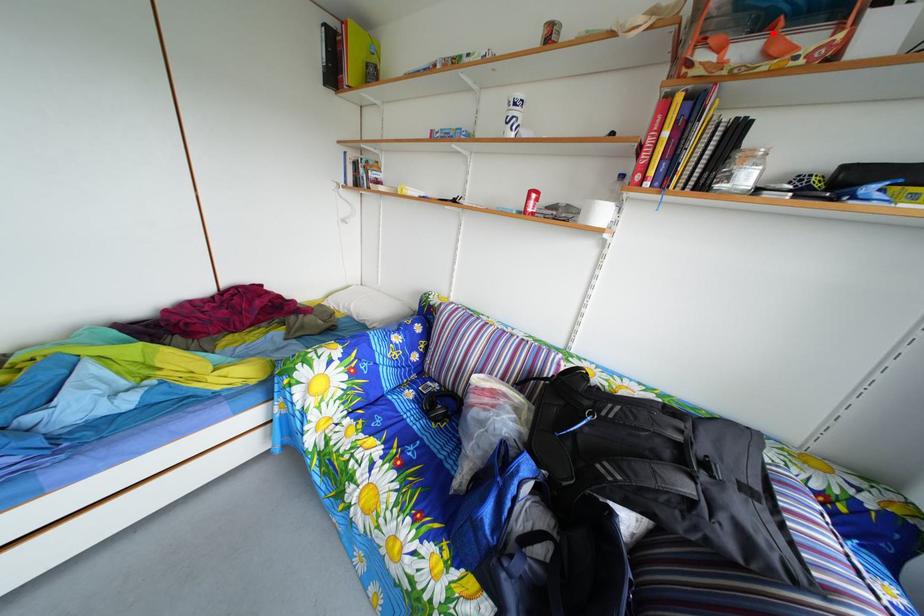
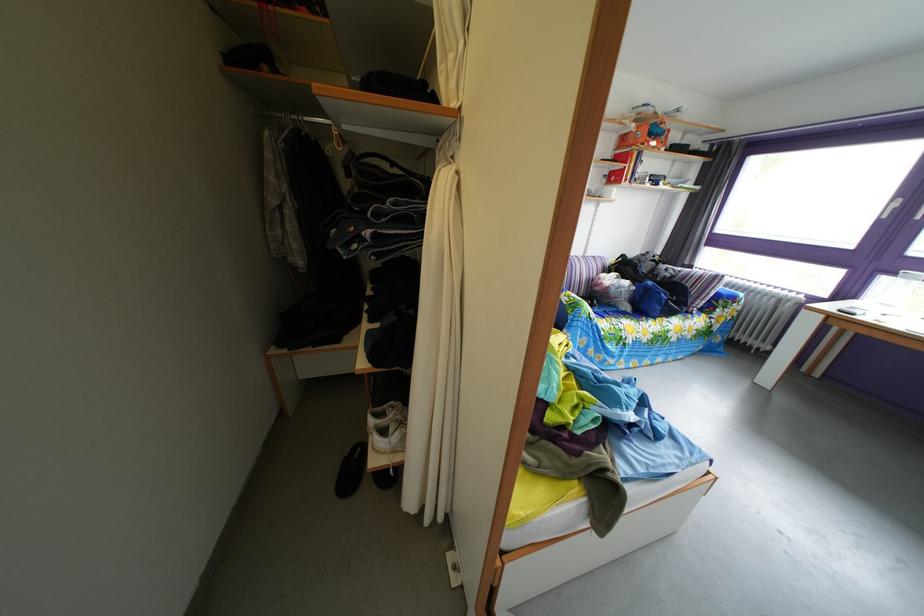
Question: I am providing you with two images of the same scene from different viewpoints. In image1, a red point is highlighted. Considering the same 3D point in image2, which of the following is correct?

Choices:
 (A) It is closer
 (B) It is farther

Answer: (A)